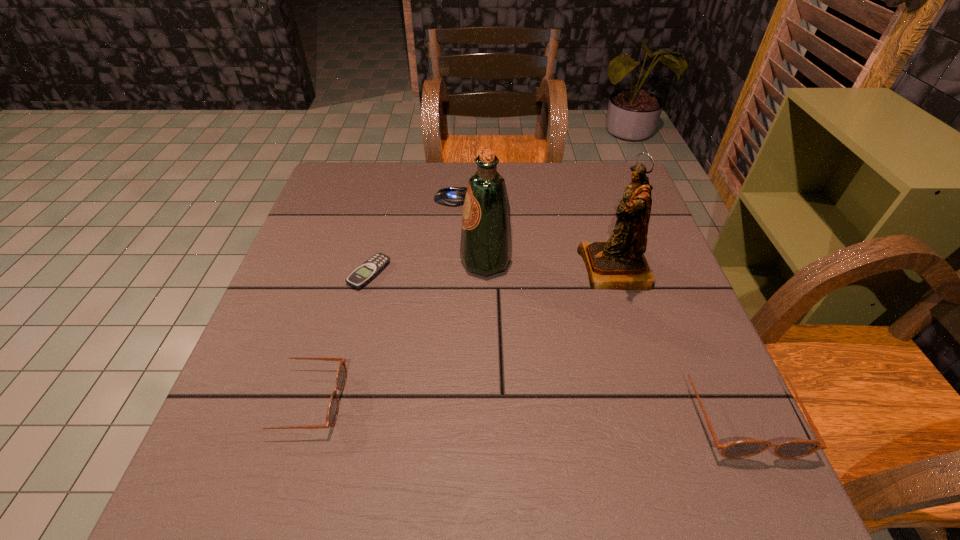
Locate which object is the fourth closest to the shorter sunglasses. Please provide its 2D coordinates. Your answer should be formatted as a tuple, i.e. [(x, y)], where the tuple contains the x and y coordinates of a point satisfying the conditions above.

[(451, 196)]

In order to click on the third closest object relative to the olive oil in this screenshot , I will do `click(365, 273)`.

The width and height of the screenshot is (960, 540). I want to click on vacant space that satisfies the following two spatial constraints: 1. on the front-facing side of the figurine; 2. on the front side of the beeper, so click(616, 273).